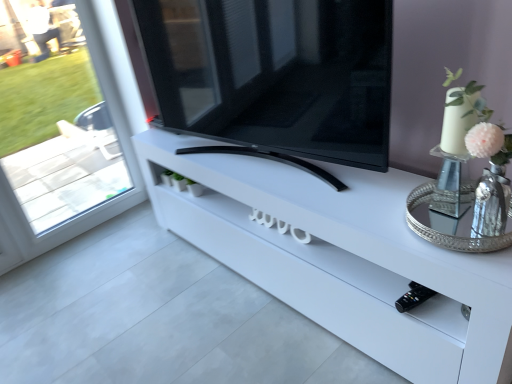
I want to click on free region on the left part of white glossy tv stand at center, so click(140, 297).